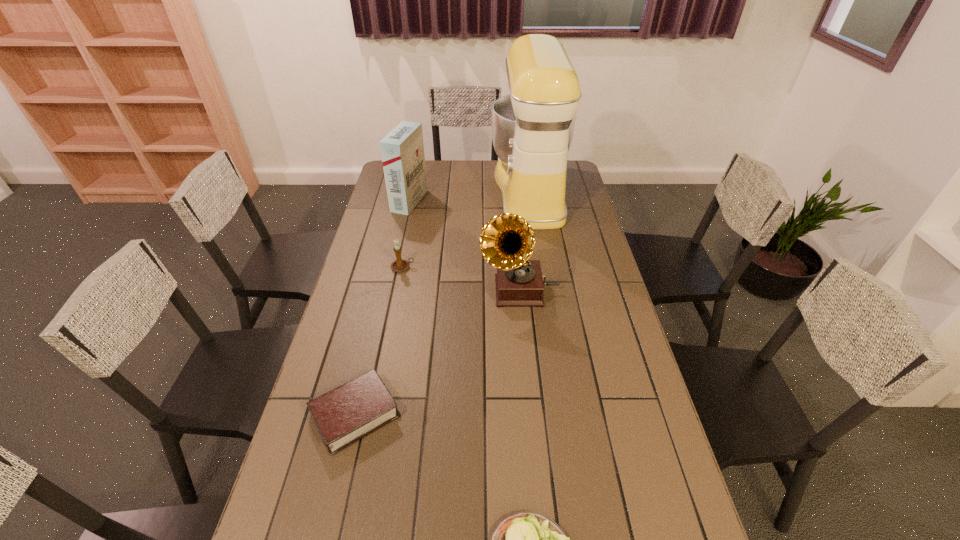
Where is `mixer`? The width and height of the screenshot is (960, 540). mixer is located at coordinates [x=532, y=128].

I want to click on cigarette case, so click(x=402, y=150).

You are a GUI agent. You are given a task and a screenshot of the screen. Output one action in this format:
    pyautogui.click(x=<x>, y=<y>)
    Task: Click on the phonograph record
    This screenshot has height=540, width=960.
    Given the screenshot: What is the action you would take?
    pyautogui.click(x=507, y=241)

Identify the location of candle holder. tap(399, 265).

Image resolution: width=960 pixels, height=540 pixels. In order to click on the second nearest object in this screenshot , I will do `click(351, 411)`.

The image size is (960, 540). I want to click on Bible, so click(x=351, y=411).

Locate an element on the screen. vacant area located on the side of the tallest object with the control knob is located at coordinates (446, 191).

The image size is (960, 540). Identify the location of free space located 0.340m on the side of the tallest object with the control knob. (416, 191).

Locate an element on the screen. This screenshot has width=960, height=540. vacant area situated 0.370m on the side of the tallest object with the control knob is located at coordinates (409, 191).

Find the location of a particular element. The width and height of the screenshot is (960, 540). free point located 0.210m on the back of the cigarette case is located at coordinates (418, 165).